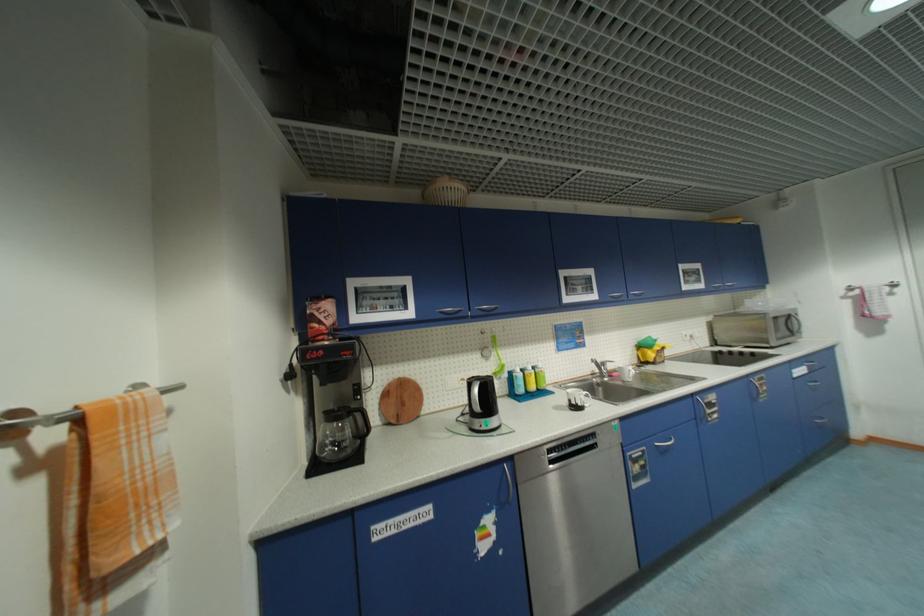
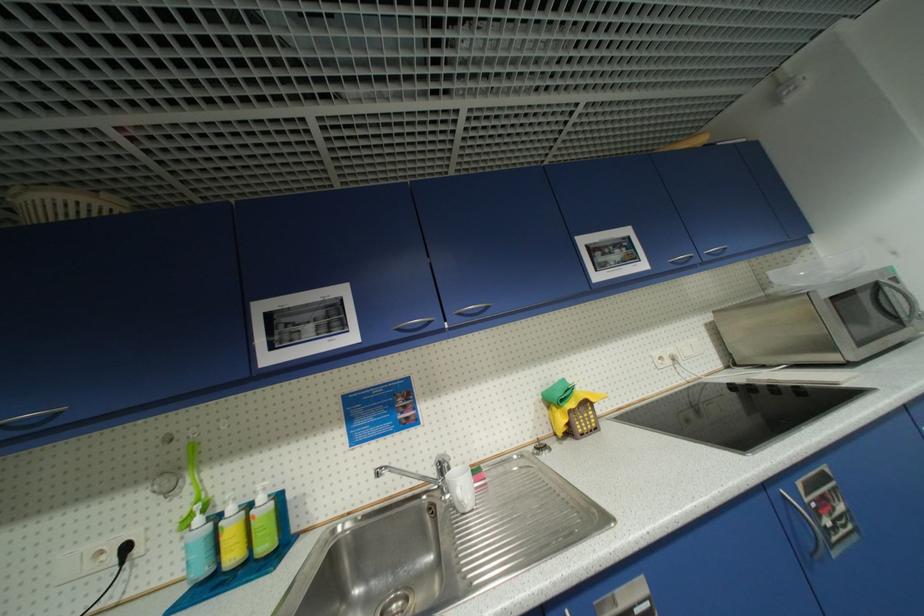
In the second image, find the point that corresponds to (x=612, y=379) in the first image.

(454, 496)